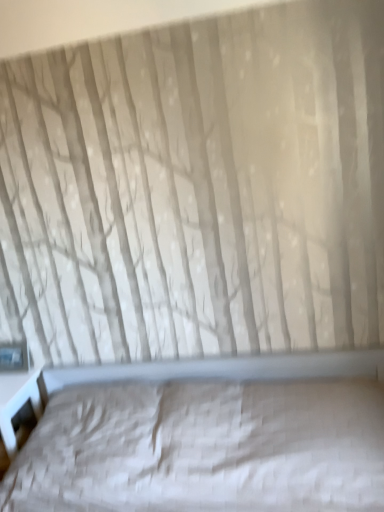
Identify the location of free space on the front side of transparent glass window at lower left. Image resolution: width=384 pixels, height=512 pixels. (13, 378).